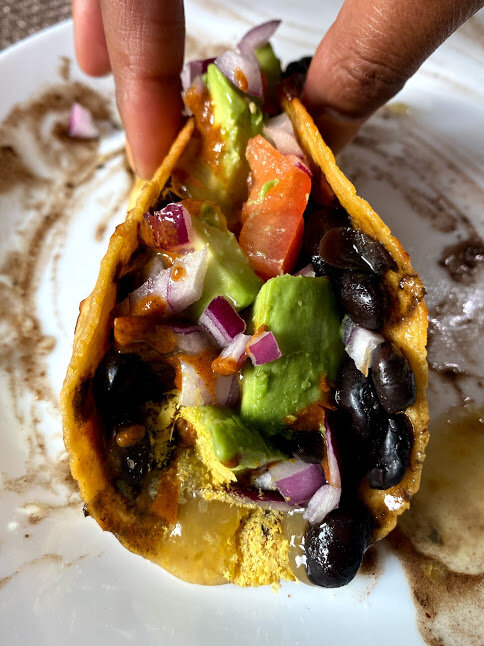
This screenshot has height=646, width=484. I want to click on plate, so click(x=76, y=561).